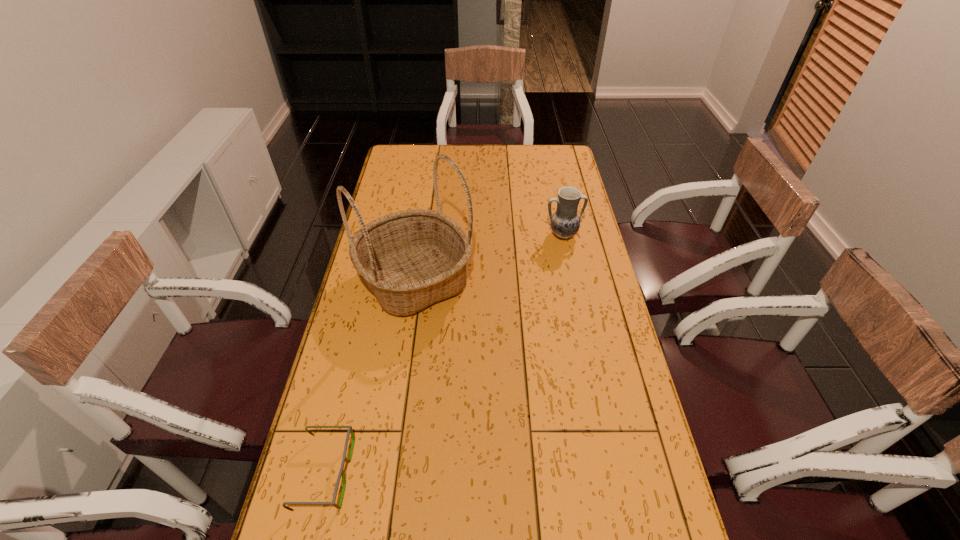
Choose which object is the nearest neighbor to the basket. Please provide its 2D coordinates. Your answer should be formatted as a tuple, i.e. [(x, y)], where the tuple contains the x and y coordinates of a point satisfying the conditions above.

[(565, 222)]

Point out which object is positioned as the nearest to the shortest object. Please provide its 2D coordinates. Your answer should be formatted as a tuple, i.e. [(x, y)], where the tuple contains the x and y coordinates of a point satisfying the conditions above.

[(411, 259)]

Image resolution: width=960 pixels, height=540 pixels. I want to click on vacant position in the image that satisfies the following two spatial constraints: 1. on the front side of the tallest object; 2. on the lens of the spectacles, so click(388, 473).

At what (x,y) coordinates should I click in order to perform the action: click on free region that satisfies the following two spatial constraints: 1. on the front side of the rightmost object; 2. on the lens of the spectacles. Please return your answer as a coordinate pair (x, y). The image size is (960, 540). Looking at the image, I should click on (612, 473).

Where is `vacant space that satisfies the following two spatial constraints: 1. on the back side of the tallest object; 2. on the left side of the rightmost object`? Image resolution: width=960 pixels, height=540 pixels. vacant space that satisfies the following two spatial constraints: 1. on the back side of the tallest object; 2. on the left side of the rightmost object is located at coordinates (422, 235).

Where is `vacant area in the image that satisfies the following two spatial constraints: 1. on the back side of the basket; 2. on the left side of the rightmost object`? This screenshot has height=540, width=960. vacant area in the image that satisfies the following two spatial constraints: 1. on the back side of the basket; 2. on the left side of the rightmost object is located at coordinates (422, 235).